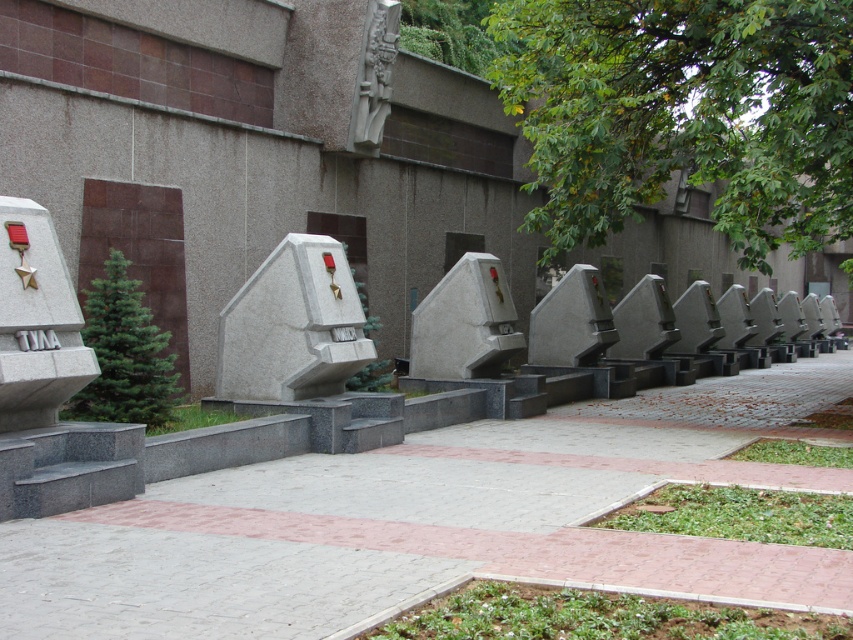
Question: Is white marble sculpture at center behind gray stone carving at upper center?

Choices:
 (A) yes
 (B) no

Answer: (B)

Question: Which of the following is the farthest from the observer?

Choices:
 (A) (427, 337)
 (B) (372, 145)

Answer: (B)

Question: Does white marble sculpture at center have a lesser width compared to gray stone carving at upper center?

Choices:
 (A) yes
 (B) no

Answer: (B)

Question: Which point is closer to the camera?

Choices:
 (A) (228, 348)
 (B) (360, 122)
 (C) (505, 301)

Answer: (A)

Question: Is white stone sculpture at center wider than white marble sculpture at center?

Choices:
 (A) no
 (B) yes

Answer: (B)

Question: Which of the following is the farthest from the observer?

Choices:
 (A) gray stone carving at upper center
 (B) white stone sculpture at center

Answer: (A)